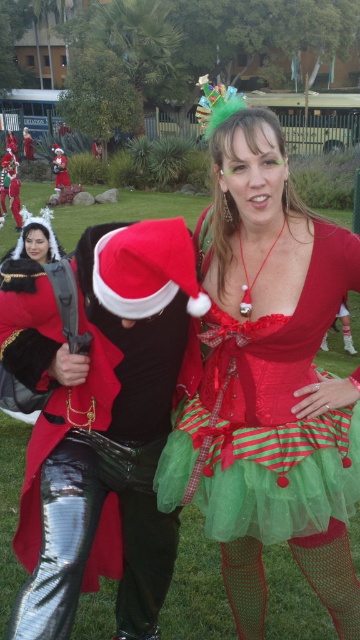
Between shiny red dress at center and shiny black pants at center, which one appears on the left side from the viewer's perspective?

From the viewer's perspective, shiny black pants at center appears more on the left side.

Is shiny red dress at center taller than shiny black pants at center?

Yes, shiny red dress at center is taller than shiny black pants at center.

Who is more forward, (315, 259) or (145, 625)?

Point (315, 259) is in front.

Locate an element on the screen. This screenshot has width=360, height=640. shiny red dress at center is located at coordinates (267, 378).